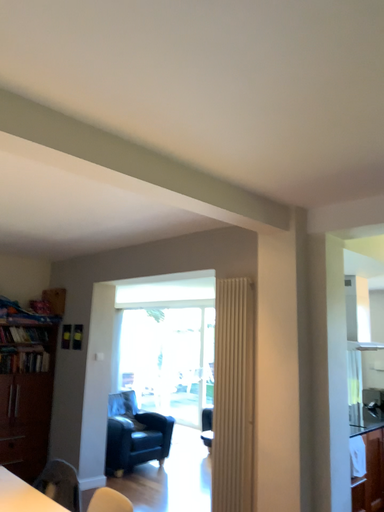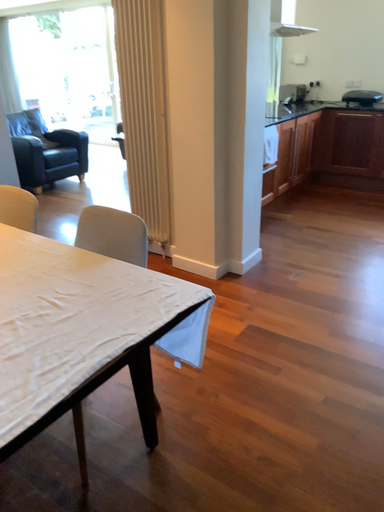
Question: How did the camera likely rotate when shooting the video?

Choices:
 (A) rotated downward
 (B) rotated upward

Answer: (A)